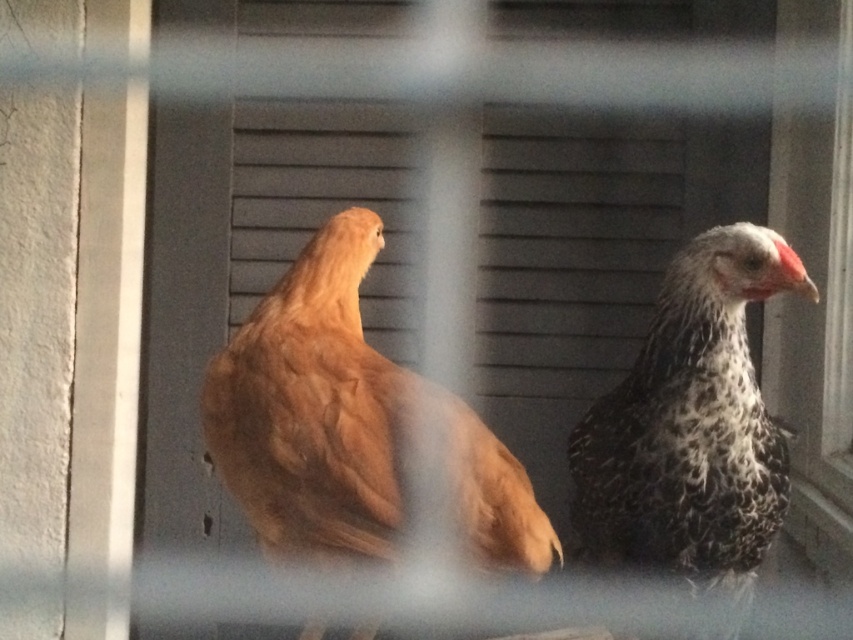
Question: Which object appears farthest from the camera in this image?

Choices:
 (A) speckled feathered chicken at right
 (B) golden feathered chicken at center

Answer: (A)

Question: Does golden feathered chicken at center have a larger size compared to speckled feathered chicken at right?

Choices:
 (A) yes
 (B) no

Answer: (B)

Question: Which of the following is the farthest from the observer?

Choices:
 (A) golden feathered chicken at center
 (B) speckled feathered chicken at right

Answer: (B)

Question: Is golden feathered chicken at center further to the viewer compared to speckled feathered chicken at right?

Choices:
 (A) no
 (B) yes

Answer: (A)

Question: Is golden feathered chicken at center thinner than speckled feathered chicken at right?

Choices:
 (A) no
 (B) yes

Answer: (A)

Question: Which point is closer to the camera?

Choices:
 (A) (323, 342)
 (B) (729, 426)

Answer: (A)